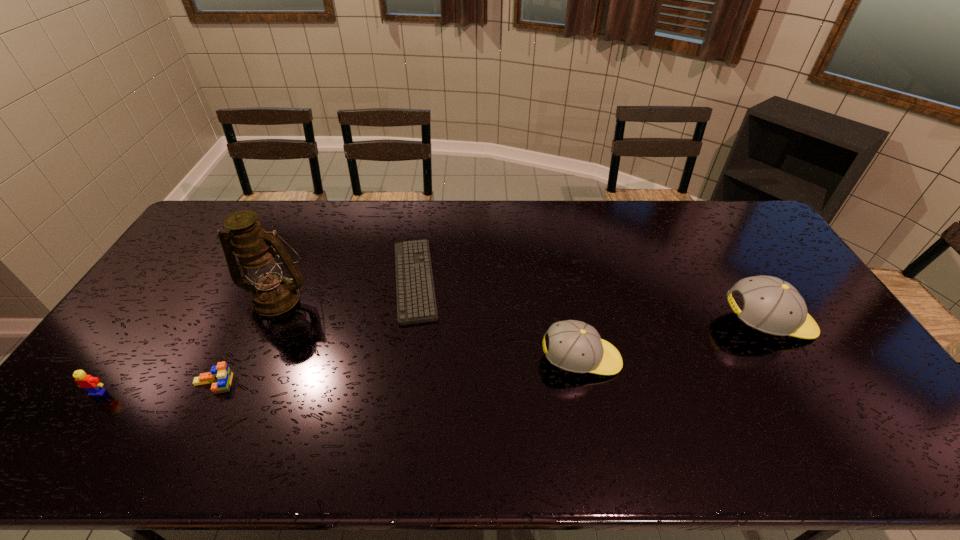
This screenshot has width=960, height=540. I want to click on free space at the right edge of the desktop, so click(789, 269).

In the image, there is a desktop. Where is `vacant space at the near left corner`? Image resolution: width=960 pixels, height=540 pixels. vacant space at the near left corner is located at coordinates point(114,389).

In the image, there is a desktop. Where is `vacant space at the near right corner`? Image resolution: width=960 pixels, height=540 pixels. vacant space at the near right corner is located at coordinates 823,387.

The image size is (960, 540). Find the location of `unoccupied position between the fourth shortest object and the taller Lego`. unoccupied position between the fourth shortest object and the taller Lego is located at coordinates (340, 376).

You are a GUI agent. You are given a task and a screenshot of the screen. Output one action in this format:
    pyautogui.click(x=<x>, y=<y>)
    Task: Click on the vacant point located between the computer keyboard and the third shortest object
    This screenshot has width=960, height=540.
    Given the screenshot: What is the action you would take?
    pyautogui.click(x=256, y=336)

Locate an element on the screen. This screenshot has width=960, height=540. empty location between the tallest object and the computer keyboard is located at coordinates (347, 289).

What are the coordinates of `vacant space that is in between the shortest object and the oil lamp` in the screenshot? It's located at click(347, 289).

What are the coordinates of `free area in between the second shortest object and the left Lego` in the screenshot? It's located at (156, 388).

You are a GUI agent. You are given a task and a screenshot of the screen. Output one action in this format:
    pyautogui.click(x=<x>, y=<y>)
    Task: Click on the unoccupied position between the oil lamp and the fifth object from left to right
    This screenshot has height=540, width=960.
    Given the screenshot: What is the action you would take?
    pyautogui.click(x=429, y=329)

Where is `vacant space that is in between the rightmost object and the shorter baseball cap`? vacant space that is in between the rightmost object and the shorter baseball cap is located at coordinates (675, 341).